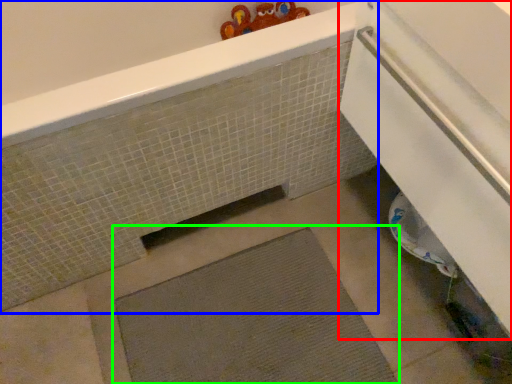
Question: Which object is the closest to the screen door (highlighted by a red box)? Choose among these: bath (highlighted by a blue box) or bath mat (highlighted by a green box).

Choices:
 (A) bath
 (B) bath mat

Answer: (A)